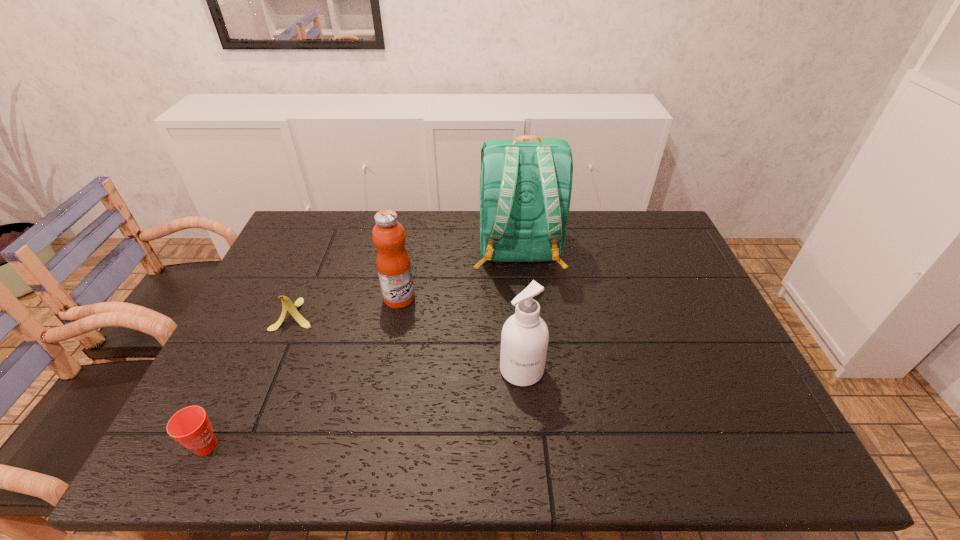
Locate an element on the screen. Image resolution: width=960 pixels, height=540 pixels. vacant space at the far left corner of the desktop is located at coordinates (332, 233).

In the image, there is a desktop. Find the location of `blank space at the near left corner`. blank space at the near left corner is located at coordinates (225, 449).

At what (x,y) coordinates should I click in order to perform the action: click on free spot at the far right corner of the desktop. Please return your answer as a coordinate pair (x, y). Looking at the image, I should click on (678, 249).

The image size is (960, 540). Find the location of `free space that is in between the second nearest object and the banana`. free space that is in between the second nearest object and the banana is located at coordinates (409, 342).

At what (x,y) coordinates should I click in order to perform the action: click on vacant point located between the nearest object and the fruit juice. Please return your answer as a coordinate pair (x, y). The image size is (960, 540). Looking at the image, I should click on (302, 372).

Image resolution: width=960 pixels, height=540 pixels. Identify the location of empty space that is in between the cup and the banana. (252, 380).

I want to click on vacant region between the banana and the fourth farthest object, so click(x=409, y=342).

Find the location of a particular element. This screenshot has width=960, height=540. free space between the farthest object and the cup is located at coordinates (363, 348).

Locate an element on the screen. Image resolution: width=960 pixels, height=540 pixels. free space between the fruit juice and the cleansing agent is located at coordinates (461, 334).

The height and width of the screenshot is (540, 960). Identify the location of free point between the banana and the cup. (252, 380).